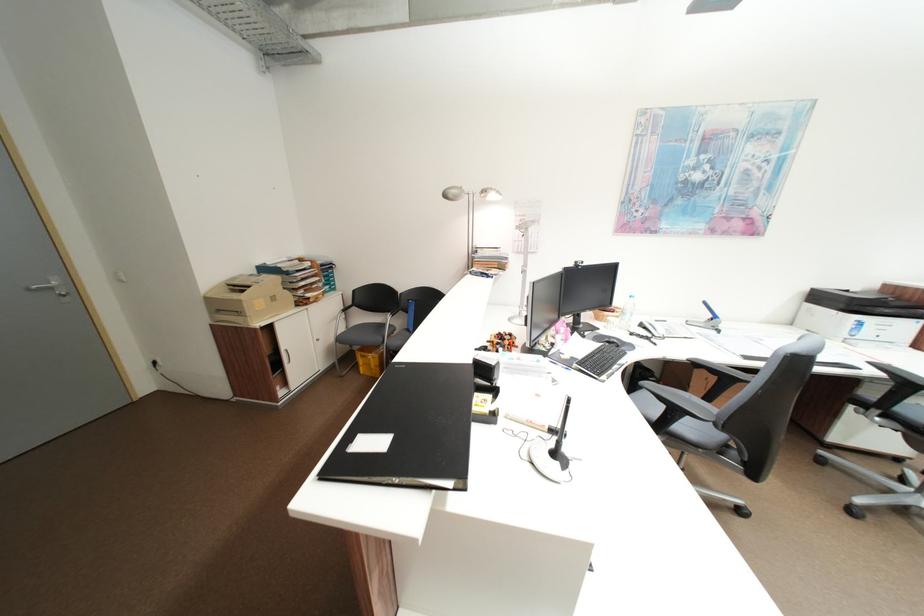
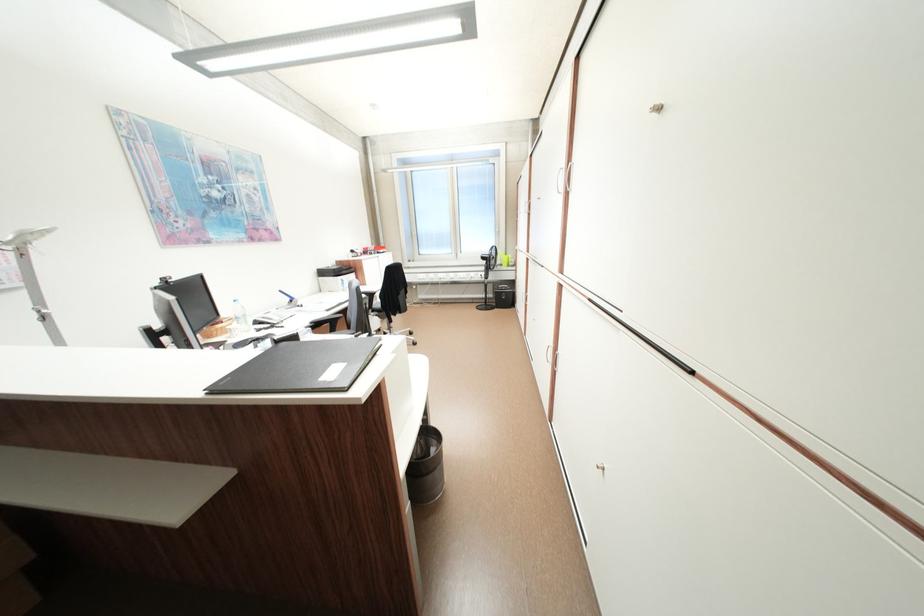
Based on the photo, the first image is from the beginning of the video and the second image is from the end. How did the camera likely rotate when shooting the video?

The camera rotated toward right-down.